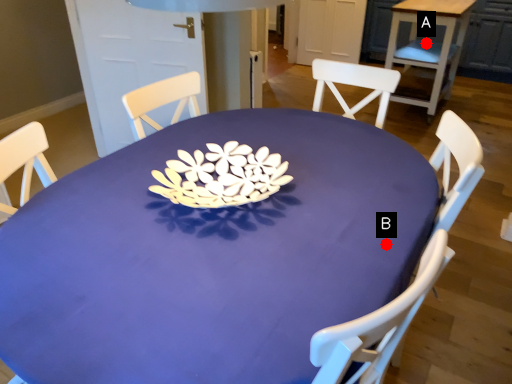
Question: Two points are circled on the image, labeled by A and B beside each circle. Which point is closer to the camera?

Choices:
 (A) A is closer
 (B) B is closer

Answer: (B)